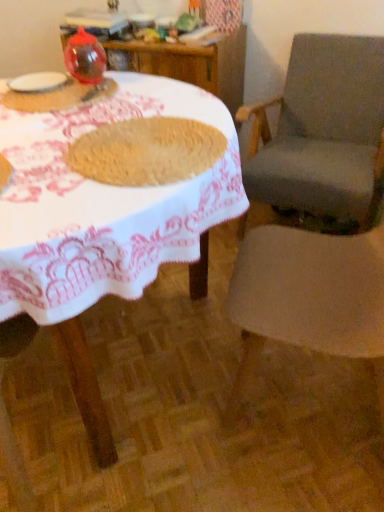
Where is `vacant region below gray fabric chair at right, the 2th chair when ordered from back to front (from a real-world perspective)`? Image resolution: width=384 pixels, height=512 pixels. vacant region below gray fabric chair at right, the 2th chair when ordered from back to front (from a real-world perspective) is located at coordinates (306, 391).